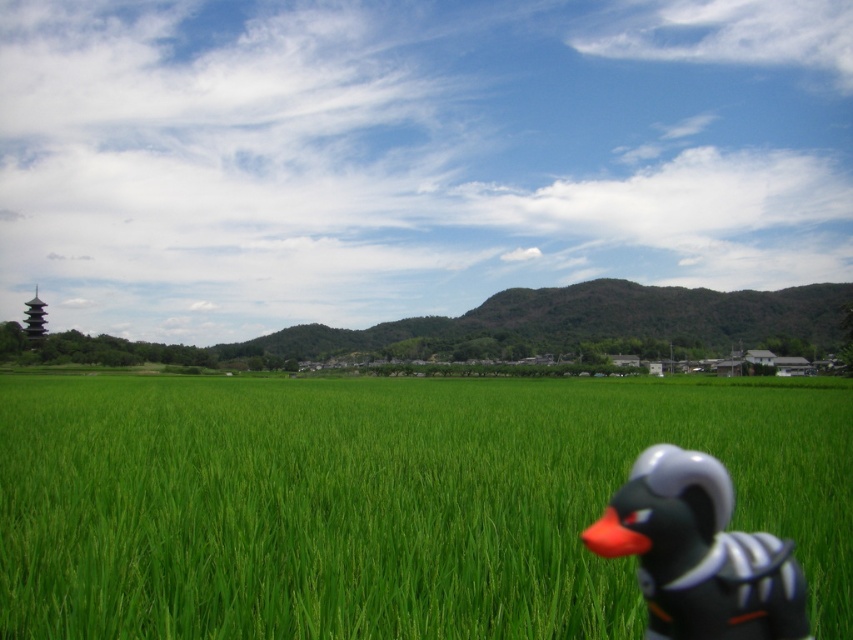
Question: Which object appears closest to the camera in this image?

Choices:
 (A) black matte rubber duck at lower right
 (B) green grass at center

Answer: (A)

Question: Is green grass at center to the right of black matte rubber duck at lower right from the viewer's perspective?

Choices:
 (A) no
 (B) yes

Answer: (B)

Question: Does green grass at center have a lesser width compared to black matte rubber duck at lower right?

Choices:
 (A) no
 (B) yes

Answer: (A)

Question: Observing the image, what is the correct spatial positioning of green grass at center in reference to black matte rubber duck at lower right?

Choices:
 (A) below
 (B) above

Answer: (A)

Question: Which of the following is the farthest from the observer?

Choices:
 (A) (712, 464)
 (B) (21, 486)

Answer: (B)